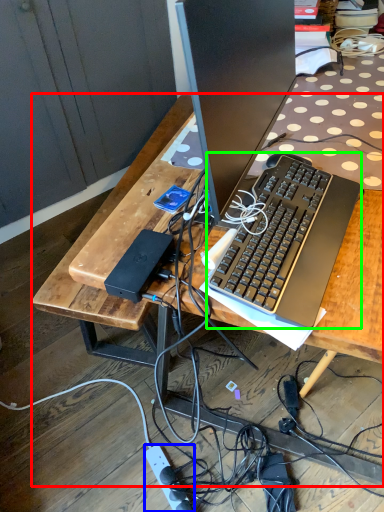
Question: Which object is the farthest from desk (highlighted by a red box)? Choose among these: power outlet (highlighted by a blue box) or computer keyboard (highlighted by a green box).

Choices:
 (A) power outlet
 (B) computer keyboard

Answer: (A)